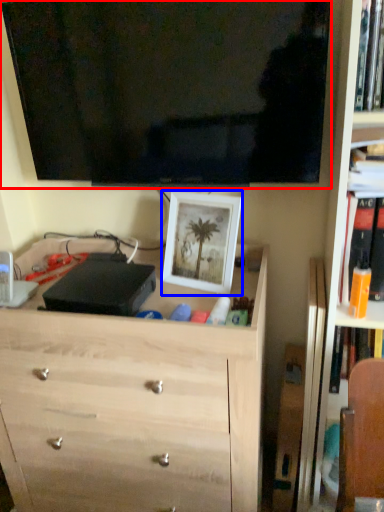
Question: Which object is closer to the camera taking this photo, television (highlighted by a red box) or picture frame (highlighted by a blue box)?

Choices:
 (A) television
 (B) picture frame

Answer: (A)